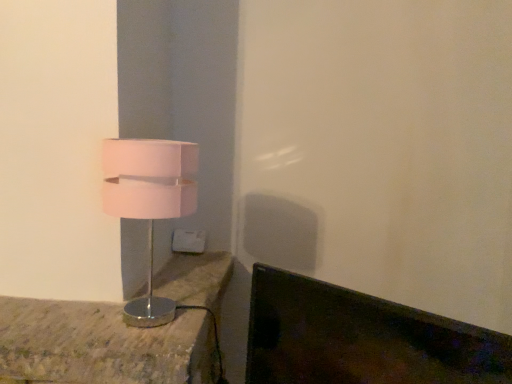
Where is `empty space that is in between pink matte lampshade at left and white plastic electric outlet at center`? empty space that is in between pink matte lampshade at left and white plastic electric outlet at center is located at coordinates (175, 282).